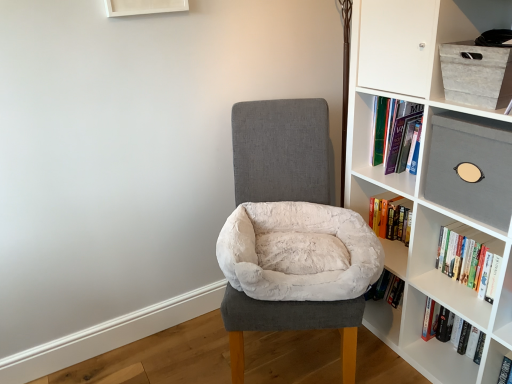
Question: Can you confirm if white plush bean bag at center is positioned to the left of matte gray box at upper right?

Choices:
 (A) no
 (B) yes

Answer: (B)

Question: Is white plush bean bag at center not near matte gray box at upper right?

Choices:
 (A) yes
 (B) no

Answer: (B)

Question: From the image's perspective, is white plush bean bag at center on matte gray box at upper right?

Choices:
 (A) no
 (B) yes

Answer: (A)

Question: Does white plush bean bag at center appear on the right side of matte gray box at upper right?

Choices:
 (A) yes
 (B) no

Answer: (B)

Question: Is white plush bean bag at center looking in the opposite direction of matte gray box at upper right?

Choices:
 (A) yes
 (B) no

Answer: (B)

Question: Is hardcover book at right, which is the 1th book in bottom-to-top order, inside or outside of white plush bean bag at center?

Choices:
 (A) inside
 (B) outside

Answer: (B)

Question: Is point (441, 317) closer or farther from the camera than point (312, 230)?

Choices:
 (A) closer
 (B) farther

Answer: (B)

Question: Considering their positions, is hardcover book at right, the second book positioned from the top, located in front of or behind white plush bean bag at center?

Choices:
 (A) front
 (B) behind

Answer: (B)

Question: Would you say hardcover book at right, which is the 1th book in bottom-to-top order, is to the left or to the right of white plush bean bag at center in the picture?

Choices:
 (A) right
 (B) left

Answer: (A)

Question: Considering the positions of hardcover book at right, the second book positioned from the top, and matte gray box at upper right in the image, is hardcover book at right, the second book positioned from the top, taller or shorter than matte gray box at upper right?

Choices:
 (A) short
 (B) tall

Answer: (A)

Question: Is hardcover book at right, the second book positioned from the top, bigger or smaller than matte gray box at upper right?

Choices:
 (A) big
 (B) small

Answer: (B)

Question: Considering the positions of point (473, 352) and point (496, 120), is point (473, 352) closer or farther from the camera than point (496, 120)?

Choices:
 (A) closer
 (B) farther

Answer: (B)

Question: Relative to matte gray box at upper right, is hardcover book at right, which is the 1th book in bottom-to-top order, in front or behind?

Choices:
 (A) front
 (B) behind

Answer: (B)

Question: Considering their positions, is white plush bean bag at center located in front of or behind hardcover book at right, the 2th book from the bottom?

Choices:
 (A) front
 (B) behind

Answer: (A)

Question: Is white plush bean bag at center situated inside hardcover book at right, arranged as the first book when viewed from the top, or outside?

Choices:
 (A) inside
 (B) outside

Answer: (B)